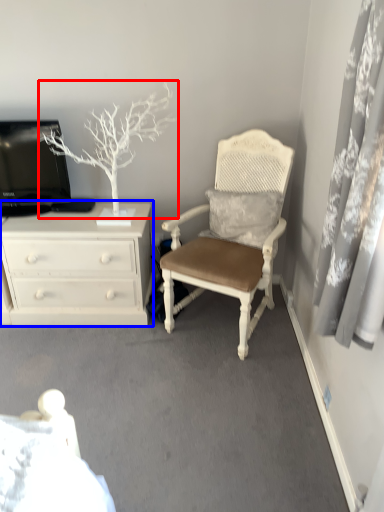
Question: Which point is further to the camera, tree (highlighted by a red box) or chest of drawers (highlighted by a blue box)?

Choices:
 (A) tree
 (B) chest of drawers

Answer: (B)